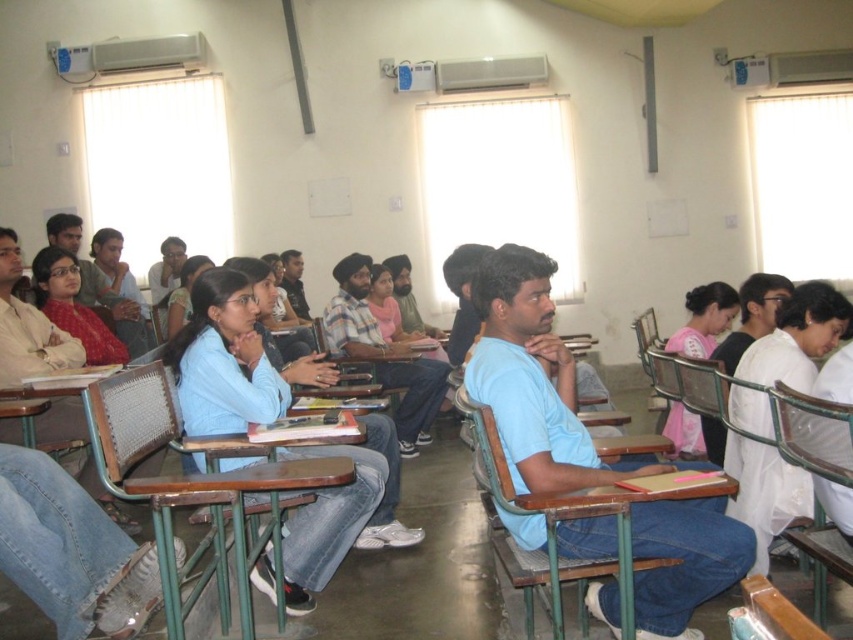
Is wooden at center further to camera compared to matte blue shirt at center?

No, wooden at center is in front of matte blue shirt at center.

Is point (239, 566) more distant than point (99, 481)?

No.

Identify the location of wooden at center. (233, 518).